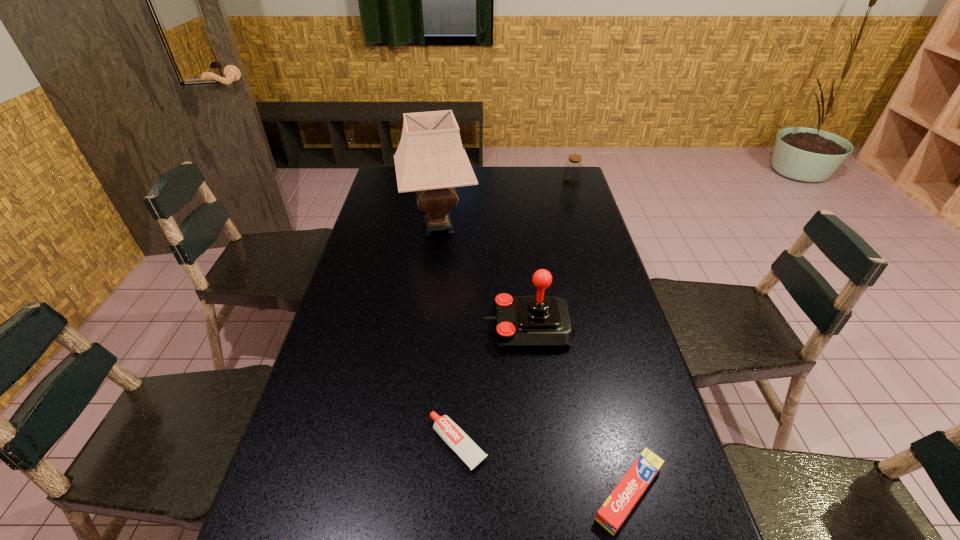
The width and height of the screenshot is (960, 540). Find the location of `free space located on the base of the joystick`. free space located on the base of the joystick is located at coordinates (411, 328).

Locate an element on the screen. This screenshot has width=960, height=540. free space located 0.400m on the base of the joystick is located at coordinates (345, 328).

I want to click on free space located 0.140m on the left of the farthest object, so click(530, 184).

Identify the location of vacant area situated on the left of the left toothpaste. The image size is (960, 540). (314, 443).

Where is `free space located on the back of the right toothpaste`? This screenshot has height=540, width=960. free space located on the back of the right toothpaste is located at coordinates (595, 356).

Locate an element on the screen. object that is at the far edge is located at coordinates (573, 168).

At what (x,y) coordinates should I click in order to perform the action: click on object located in the left edge section of the desktop. Please return your answer as a coordinate pair (x, y). This screenshot has height=540, width=960. Looking at the image, I should click on (430, 160).

Locate an element on the screen. The height and width of the screenshot is (540, 960). jar at the right edge is located at coordinates (573, 168).

Identify the location of toothpaste at the right edge. (614, 511).

Find the location of a particular element. Image resolution: width=960 pixels, height=540 pixels. object positioned at the far right corner is located at coordinates (573, 168).